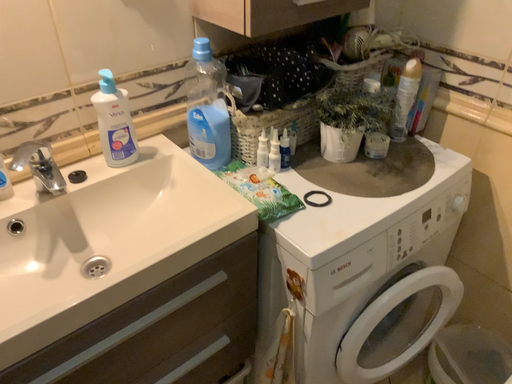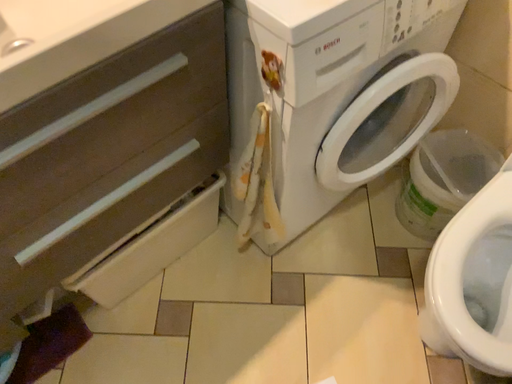
Question: How did the camera likely rotate when shooting the video?

Choices:
 (A) rotated downward
 (B) rotated upward

Answer: (A)